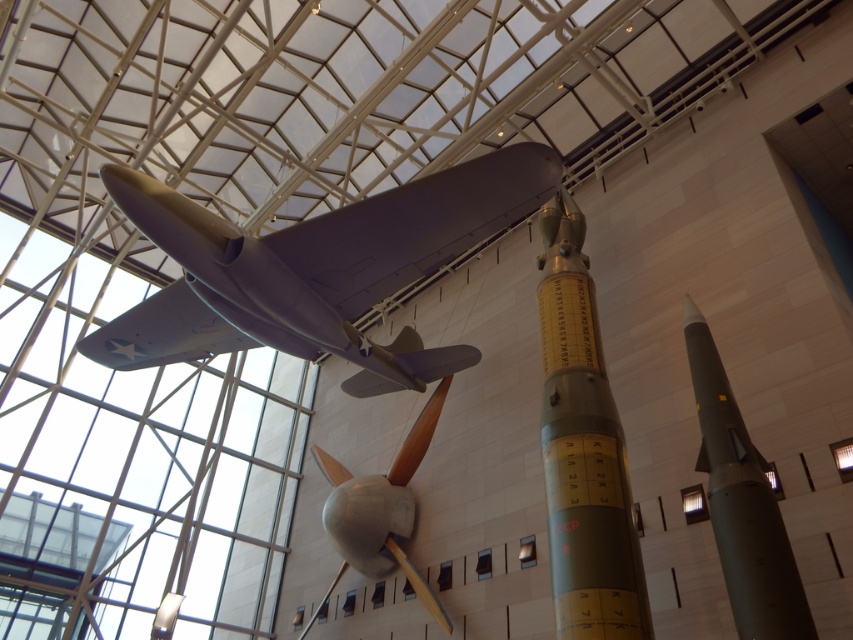
Does point (605, 556) lie behind point (706, 417)?

No, it is in front of (706, 417).

Measure the distance between green metallic rocket at center and camera.

green metallic rocket at center is 8.05 meters away from camera.

Between point (556, 483) and point (700, 417), which one is positioned in front?

Point (556, 483) is in front.

Locate an element on the screen. The height and width of the screenshot is (640, 853). green metallic rocket at center is located at coordinates (583, 449).

Does green metallic rocket at center have a greater width compared to silver metallic propeller at center?

Correct, the width of green metallic rocket at center exceeds that of silver metallic propeller at center.

Who is higher up, green metallic rocket at center or silver metallic propeller at center?

green metallic rocket at center is higher up.

Between point (582, 452) and point (358, 483), which one is positioned in front?

Point (582, 452)

Identify the location of green metallic rocket at center. This screenshot has width=853, height=640. (583, 449).

Is matte gray airplane at center taller than silver metallic propeller at center?

Yes.

Who is positioned more to the right, matte gray airplane at center or silver metallic propeller at center?

silver metallic propeller at center is more to the right.

Is point (346, 257) in front of point (440, 406)?

That is True.

The height and width of the screenshot is (640, 853). What are the coordinates of `matte gray airplane at center` in the screenshot? It's located at (315, 269).